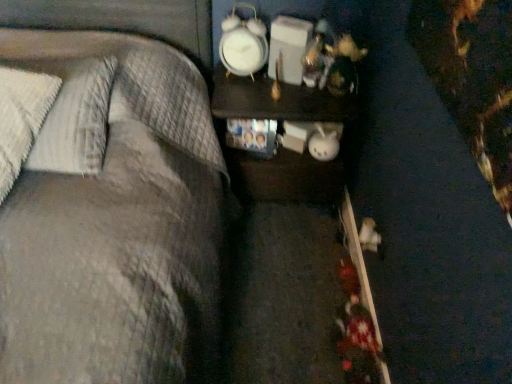
Question: Is point (316, 96) closer or farther from the camera than point (239, 33)?

Choices:
 (A) farther
 (B) closer

Answer: (A)

Question: Considering the relative positions of dark wood nightstand at center and white plastic clock at upper center in the image provided, is dark wood nightstand at center to the left or to the right of white plastic clock at upper center?

Choices:
 (A) right
 (B) left

Answer: (A)

Question: Considering the real-world distances, which object is closest to the dark wood nightstand at center?

Choices:
 (A) white plastic clock at upper center
 (B) white textured pillow at left

Answer: (A)

Question: Which of these objects is positioned farthest from the white plastic clock at upper center?

Choices:
 (A) white textured pillow at left
 (B) dark wood nightstand at center

Answer: (A)